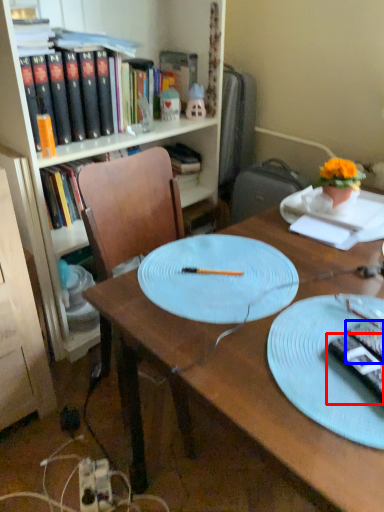
Question: Among these objects, which one is nearest to the camera, remote control (highlighted by a red box) or remote control (highlighted by a blue box)?

Choices:
 (A) remote control
 (B) remote control

Answer: (A)